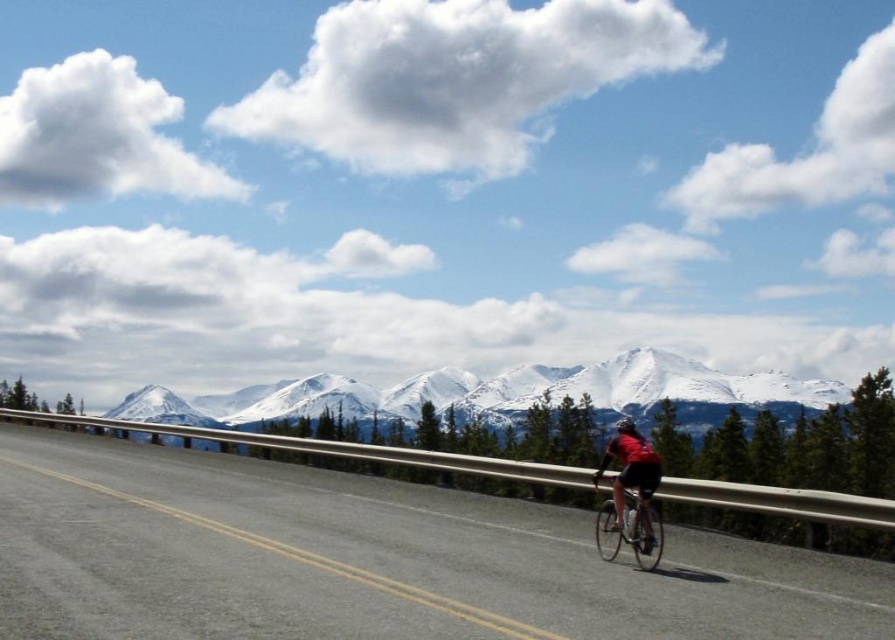
Question: Where is snowy granite mountains at upper center located in relation to red fabric cyclist at center in the image?

Choices:
 (A) below
 (B) above

Answer: (A)

Question: Which point is closer to the camera?

Choices:
 (A) (x=688, y=582)
 (B) (x=634, y=404)
 (C) (x=627, y=432)

Answer: (A)

Question: Which of the following is the farthest from the observer?

Choices:
 (A) shiny black helmet at center
 (B) black asphalt road at center
 (C) snowy granite mountains at upper center

Answer: (C)

Question: Which point is farther from the camera taking this photo?

Choices:
 (A) (54, 502)
 (B) (623, 419)
 (C) (672, 397)

Answer: (C)

Question: Is black asphalt road at center to the right of shiny black helmet at center from the viewer's perspective?

Choices:
 (A) no
 (B) yes

Answer: (A)

Question: Observing the image, what is the correct spatial positioning of snowy granite mountains at upper center in reference to red fabric cyclist at center?

Choices:
 (A) left
 (B) right

Answer: (A)